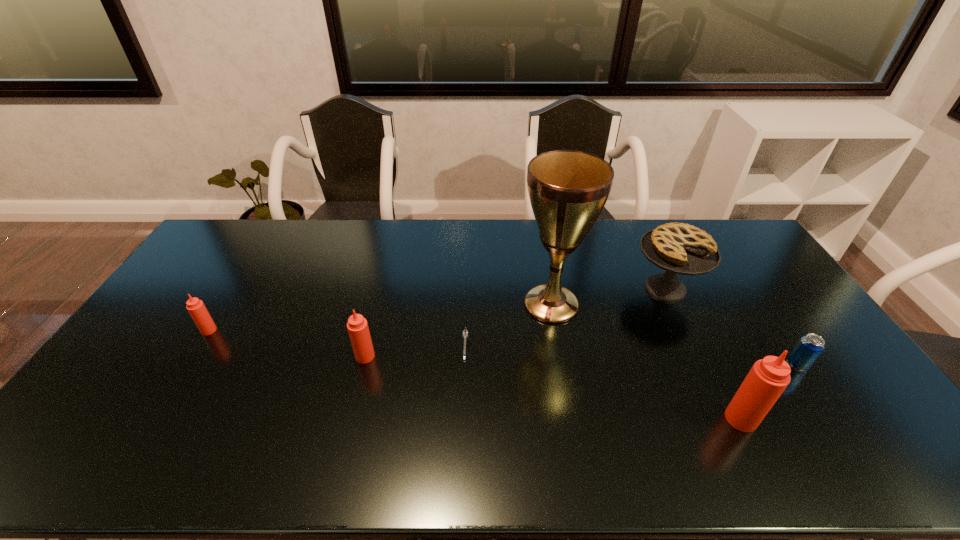
Locate an element on the screen. The width and height of the screenshot is (960, 540). object at the near edge is located at coordinates (768, 378).

Find the location of a particular element. object that is at the right edge is located at coordinates (810, 346).

Image resolution: width=960 pixels, height=540 pixels. In the image, there is a desktop. What are the coordinates of `vacant space at the far edge` in the screenshot? It's located at (447, 242).

Where is `vacant space at the near edge of the desktop`? vacant space at the near edge of the desktop is located at coordinates tap(419, 422).

Locate an element on the screen. free location at the left edge is located at coordinates (199, 265).

In order to click on free space at the right edge in this screenshot , I will do `click(785, 360)`.

At what (x,y) coordinates should I click in order to perform the action: click on free space at the far left corner of the desktop. Please return your answer as a coordinate pair (x, y). Looking at the image, I should click on (246, 252).

This screenshot has width=960, height=540. In the image, there is a desktop. In order to click on vacant area at the near right corner in this screenshot , I will do `click(884, 414)`.

Locate an element on the screen. This screenshot has width=960, height=540. unoccupied position between the farthest Tabasco sauce and the rightmost Tabasco sauce is located at coordinates (475, 375).

Where is `free spot between the beer can and the sixth object from right to left`? This screenshot has width=960, height=540. free spot between the beer can and the sixth object from right to left is located at coordinates (582, 360).